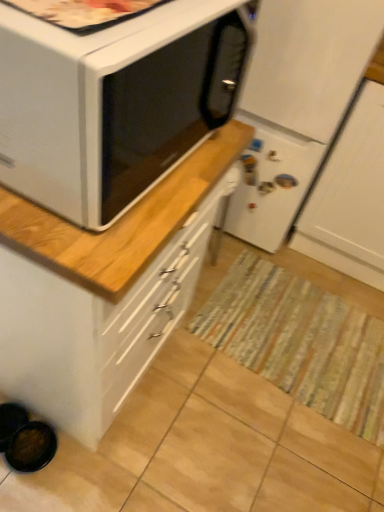
The image size is (384, 512). Identify the location of white matte refrigerator at center. (297, 102).

Is white matte refrigerator at center not inside white matte microwave oven at upper left?

Indeed, white matte refrigerator at center is completely outside white matte microwave oven at upper left.

Based on the photo, how different are the orientations of white matte refrigerator at center and white matte microwave oven at upper left in degrees?

The angle between the facing direction of white matte refrigerator at center and the facing direction of white matte microwave oven at upper left is 88.1 degrees.

The image size is (384, 512). Find the location of `refrigerator lying on the right of white matte microwave oven at upper left`. refrigerator lying on the right of white matte microwave oven at upper left is located at coordinates (297, 102).

Is white matte refrigerator at center to the left of white matte microwave oven at upper left from the viewer's perspective?

Incorrect, white matte refrigerator at center is not on the left side of white matte microwave oven at upper left.

Considering the relative positions of white matte microwave oven at upper left and white matte refrigerator at center in the image provided, is white matte microwave oven at upper left to the left of white matte refrigerator at center from the viewer's perspective?

Yes.

Can we say white matte microwave oven at upper left lies outside white matte refrigerator at center?

Yes, white matte microwave oven at upper left is not within white matte refrigerator at center.

From the image's perspective, which one is positioned higher, white matte microwave oven at upper left or white matte refrigerator at center?

white matte refrigerator at center is shown above in the image.

Is white matte microwave oven at upper left closer to camera compared to white matte refrigerator at center?

Yes, white matte microwave oven at upper left is closer to the viewer.

Between white matte microwave oven at upper left and white glossy cabinet at upper left, which one has larger width?

white glossy cabinet at upper left.

From a real-world perspective, who is located higher, white matte microwave oven at upper left or white glossy cabinet at upper left?

From a 3D spatial view, white matte microwave oven at upper left is above.

Considering the sizes of white matte microwave oven at upper left and white glossy cabinet at upper left in the image, is white matte microwave oven at upper left bigger or smaller than white glossy cabinet at upper left?

Considering their sizes, white matte microwave oven at upper left takes up less space than white glossy cabinet at upper left.

Is white matte microwave oven at upper left facing away from white glossy cabinet at upper left?

No, white matte microwave oven at upper left's orientation is not away from white glossy cabinet at upper left.

This screenshot has height=512, width=384. In order to click on cabinetry below the white matte refrigerator at center (from the image's perspective) in this screenshot , I will do `click(102, 291)`.

Is white matte refrigerator at center wider than white glossy cabinet at upper left?

Indeed, white matte refrigerator at center has a greater width compared to white glossy cabinet at upper left.

Looking at this image, considering the sizes of white matte refrigerator at center and white glossy cabinet at upper left in the image, is white matte refrigerator at center taller or shorter than white glossy cabinet at upper left?

Considering their sizes, white matte refrigerator at center has more height than white glossy cabinet at upper left.

Does white matte refrigerator at center turn towards white glossy cabinet at upper left?

Yes, white matte refrigerator at center is turned towards white glossy cabinet at upper left.

Identify the location of refrigerator on the left of the striped fabric mat at center. (297, 102).

Is striped fabric mat at center at the back of white matte refrigerator at center?

No.

In the image, is white matte refrigerator at center on the left side or the right side of striped fabric mat at center?

In the image, white matte refrigerator at center appears on the left side of striped fabric mat at center.

How far apart are white matte refrigerator at center and striped fabric mat at center?

white matte refrigerator at center and striped fabric mat at center are 60.35 centimeters apart from each other.

How much distance is there between white glossy cabinet at upper left and white matte refrigerator at center?

white glossy cabinet at upper left is 32.94 inches away from white matte refrigerator at center.

From the image's perspective, which one is positioned higher, white glossy cabinet at upper left or white matte refrigerator at center?

white matte refrigerator at center.

Which object is further away from the camera, white glossy cabinet at upper left or white matte refrigerator at center?

white matte refrigerator at center is further away from the camera.

Is point (97, 402) positioned behind point (265, 1)?

No, (97, 402) is in front of (265, 1).

From the image's perspective, is striped fabric mat at center above white matte refrigerator at center?

Actually, striped fabric mat at center appears below white matte refrigerator at center in the image.

Does striped fabric mat at center have a greater width compared to white matte refrigerator at center?

No.

Is striped fabric mat at center inside the boundaries of white matte refrigerator at center, or outside?

striped fabric mat at center is outside white matte refrigerator at center.

From a real-world perspective, is striped fabric mat at center over white matte refrigerator at center?

No, from a real-world perspective, striped fabric mat at center is not over white matte refrigerator at center

Identify the location of refrigerator that is on the right side of white matte microwave oven at upper left. The image size is (384, 512). (297, 102).

The image size is (384, 512). I want to click on microwave oven on the left of white matte refrigerator at center, so click(114, 102).

Considering their positions, is white glossy cabinet at upper left positioned further to striped fabric mat at center than white matte refrigerator at center?

The object further to striped fabric mat at center is white glossy cabinet at upper left.

Based on their spatial positions, is white glossy cabinet at upper left or striped fabric mat at center further from white matte microwave oven at upper left?

Based on the image, white glossy cabinet at upper left appears to be further to white matte microwave oven at upper left.

Based on their spatial positions, is striped fabric mat at center or white glossy cabinet at upper left further from white matte refrigerator at center?

white glossy cabinet at upper left.

When comparing their distances from white glossy cabinet at upper left, does white matte refrigerator at center or striped fabric mat at center seem further?

The object further to white glossy cabinet at upper left is white matte refrigerator at center.

Estimate the real-world distances between objects in this image. Which object is closer to white matte refrigerator at center, white glossy cabinet at upper left or striped fabric mat at center?

striped fabric mat at center is positioned closer to the anchor white matte refrigerator at center.

Considering their positions, is white matte refrigerator at center positioned further to striped fabric mat at center than white matte microwave oven at upper left?

white matte microwave oven at upper left is further to striped fabric mat at center.

When comparing their distances from white glossy cabinet at upper left, does striped fabric mat at center or white matte refrigerator at center seem closer?

striped fabric mat at center.

Based on the photo, looking at the image, which one is located closer to striped fabric mat at center, white matte microwave oven at upper left or white glossy cabinet at upper left?

white glossy cabinet at upper left is closer to striped fabric mat at center.

You are a GUI agent. You are given a task and a screenshot of the screen. Output one action in this format:
    pyautogui.click(x=<x>, y=<y>)
    Task: Click on the refrigerator between white matte microwave oven at upper left and striped fabric mat at center along the z-axis
    
    Given the screenshot: What is the action you would take?
    click(297, 102)

Identify the location of cabinetry between white matte microwave oven at upper left and white matte refrigerator at center in the front-back direction. This screenshot has height=512, width=384. 102,291.

The height and width of the screenshot is (512, 384). What are the coordinates of `cabinetry located between white matte microwave oven at upper left and striped fabric mat at center in the depth direction` in the screenshot? It's located at (102, 291).

Where is `cabinetry between white matte refrigerator at center and striped fabric mat at center in the vertical direction`? cabinetry between white matte refrigerator at center and striped fabric mat at center in the vertical direction is located at coordinates (102, 291).